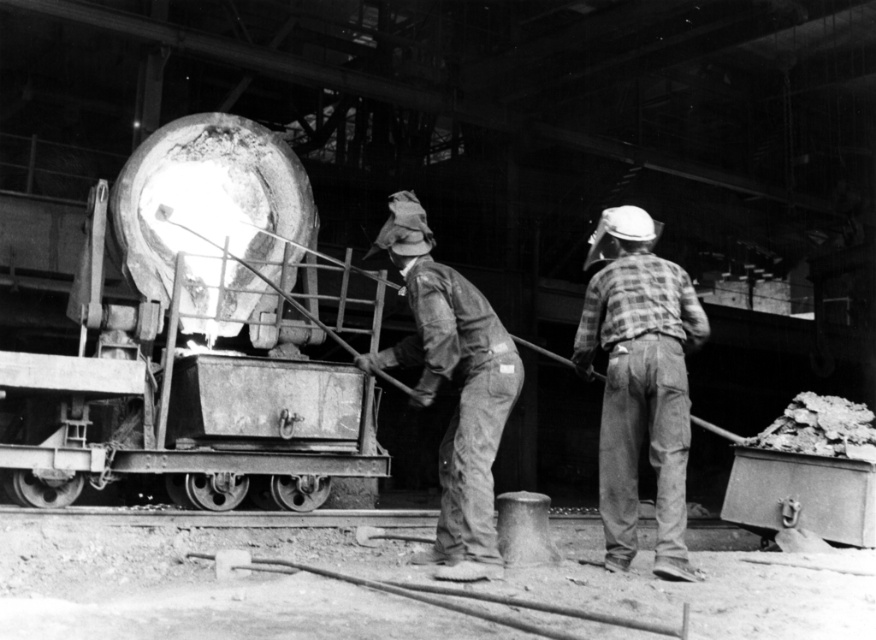
Question: Is plaid fabric shirt at right thinner than rusty metal shovel at center?

Choices:
 (A) yes
 (B) no

Answer: (A)

Question: Which point appears closest to the camera in this image?

Choices:
 (A) (651, 404)
 (B) (451, 326)

Answer: (B)

Question: Does plaid fabric shirt at right appear over rusty metal shovel at center?

Choices:
 (A) yes
 (B) no

Answer: (B)

Question: Does plaid fabric shirt at right appear over rusty metal shovel at center?

Choices:
 (A) yes
 (B) no

Answer: (B)

Question: Which point is closer to the camera taking this photo?

Choices:
 (A) (677, 426)
 (B) (428, 284)

Answer: (A)

Question: Which of the following is the farthest from the observer?

Choices:
 (A) rusty metal shovel at center
 (B) plaid fabric shirt at right

Answer: (B)